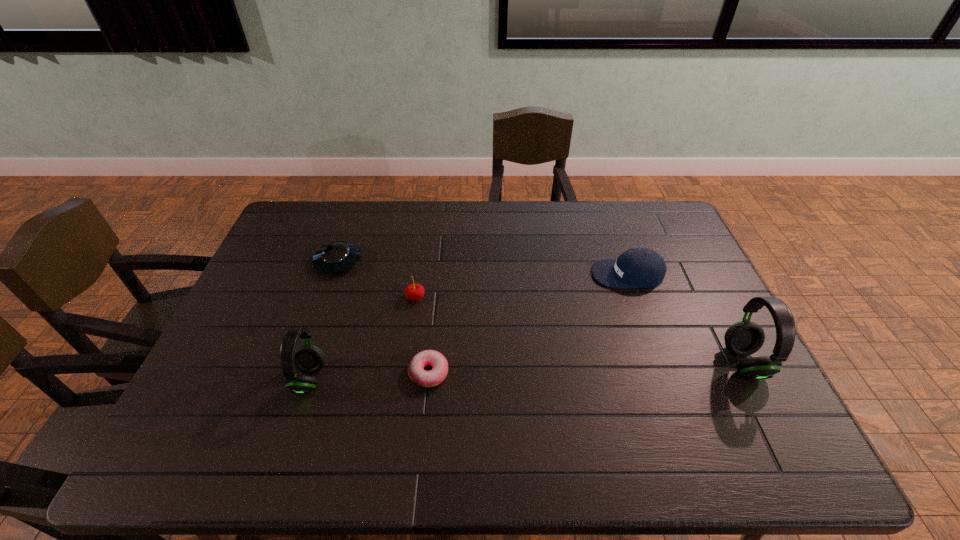
This screenshot has width=960, height=540. Identify the location of the shorter headset. 309,359.

Image resolution: width=960 pixels, height=540 pixels. What are the coordinates of `the left headset` in the screenshot? It's located at (309, 359).

Where is `the rightmost object`? the rightmost object is located at coordinates (743, 338).

Find the location of a particular element. This screenshot has width=960, height=540. the right headset is located at coordinates point(743,338).

Image resolution: width=960 pixels, height=540 pixels. In order to click on saucer in this screenshot , I will do `click(336, 257)`.

Where is `baseball cap`? baseball cap is located at coordinates (638, 267).

This screenshot has height=540, width=960. Identify the location of the fourth tallest object. (638, 267).

At what (x,y) coordinates should I click in order to perform the action: click on the third farthest object. Please return your answer as a coordinate pair (x, y). Looking at the image, I should click on (414, 292).

I want to click on the shortest object, so click(x=433, y=377).

At what (x,y) coordinates should I click in order to perform the action: click on vacant region located 0.100m on the ear cups of the shorter headset. Please return your answer as a coordinate pair (x, y). Looking at the image, I should click on (254, 379).